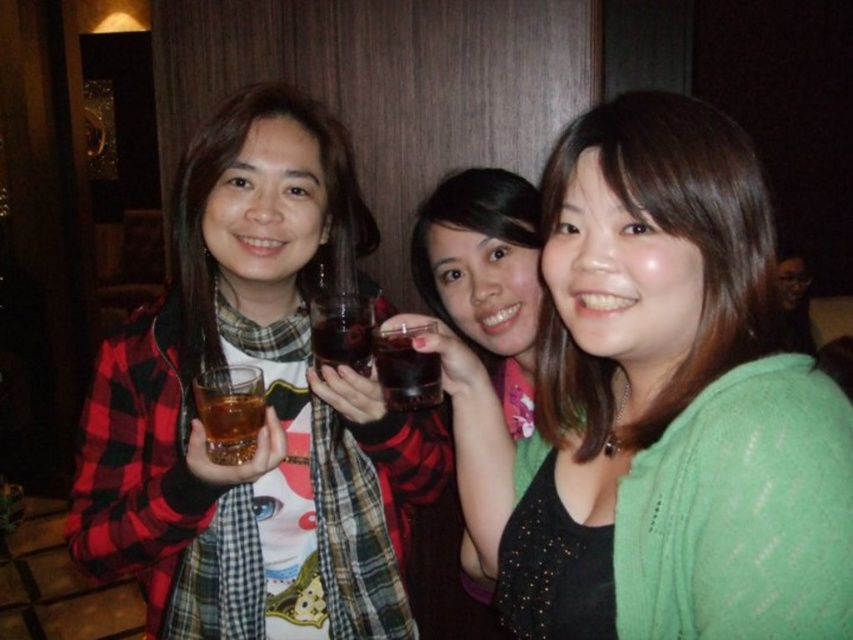
You are at a party and want to hand a small note to the person wearing the matte plaid shirt at left without being noticed by the person holding the translucent glass at center. Which direction should you approach from?

You should approach from behind the matte plaid shirt at left because the translucent glass at center is shorter than the matte plaid shirt at left, so the person in the plaid shirt can block your view from the center person.

You are a photographer trying to capture a group photo of the matte plaid shirt at left and the translucent glass at center. If you want to ensure both are fully visible in the frame, which subject should you position closer to the camera to avoid cropping?

The translucent glass at center should be positioned closer to the camera because it is narrower than the matte plaid shirt at left, so it requires less space in the frame to be fully visible.

You are at a party and want to grab the translucent glass at center without touching the green knitted sweater at center. Which direction should you approach from?

The green knitted sweater at center is positioned on the right side of the translucent glass at center. To avoid touching it, approach from the left side of the translucent glass at center.